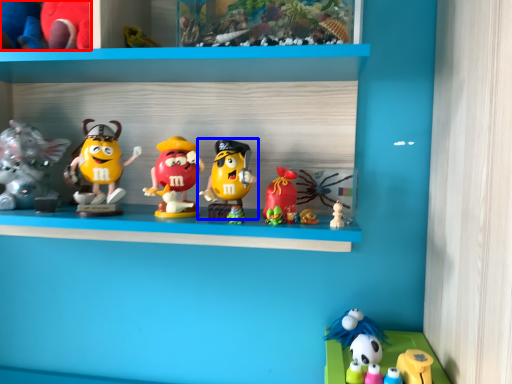
Question: Which of the following is the farthest to the observer, toy (highlighted by a red box) or toy (highlighted by a blue box)?

Choices:
 (A) toy
 (B) toy

Answer: (A)